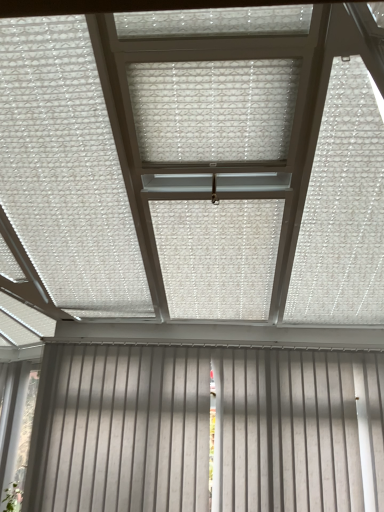
The width and height of the screenshot is (384, 512). Identify the location of white matte blinds at lower center. (203, 430).

The image size is (384, 512). Describe the element at coordinates (203, 430) in the screenshot. I see `white matte blinds at lower center` at that location.

Describe the element at coordinates (214, 110) in the screenshot. I see `translucent plastic blind at center` at that location.

The image size is (384, 512). I want to click on translucent plastic blind at center, so click(214, 110).

From the picture: Measure the distance between point (x=237, y=68) and camera.

Point (x=237, y=68) is 5.12 feet from camera.

Find the location of `white matte blinds at lower center`. white matte blinds at lower center is located at coordinates (203, 430).

Can you confirm if white matte blinds at lower center is positioned to the left of translucent plastic blind at center?

Incorrect, white matte blinds at lower center is not on the left side of translucent plastic blind at center.

From the picture: Which object is more forward, white matte blinds at lower center or translucent plastic blind at center?

translucent plastic blind at center is in front.

Considering the positions of points (199, 380) and (279, 156), is point (199, 380) farther from camera compared to point (279, 156)?

That is True.

From the image's perspective, who appears lower, white matte blinds at lower center or translucent plastic blind at center?

From the image's view, white matte blinds at lower center is below.

From a real-world perspective, is white matte blinds at lower center physically above translucent plastic blind at center?

No.

Is white matte blinds at lower center thinner than translucent plastic blind at center?

Yes.

Considering the sizes of white matte blinds at lower center and translucent plastic blind at center in the image, is white matte blinds at lower center taller or shorter than translucent plastic blind at center?

white matte blinds at lower center is taller than translucent plastic blind at center.

Considering the relative sizes of white matte blinds at lower center and translucent plastic blind at center in the image provided, is white matte blinds at lower center smaller than translucent plastic blind at center?

Incorrect, white matte blinds at lower center is not smaller in size than translucent plastic blind at center.

Does white matte blinds at lower center contain translucent plastic blind at center?

That's incorrect, translucent plastic blind at center is not inside white matte blinds at lower center.

Is white matte blinds at lower center next to translucent plastic blind at center?

No.

Is white matte blinds at lower center oriented towards translucent plastic blind at center?

No, white matte blinds at lower center does not turn towards translucent plastic blind at center.

The width and height of the screenshot is (384, 512). What are the coordinates of `blind positioned vertically above the white matte blinds at lower center (from a real-world perspective)` in the screenshot? It's located at [214, 110].

Is translucent plastic blind at center at the left side of white matte blinds at lower center?

Yes, translucent plastic blind at center is to the left of white matte blinds at lower center.

Considering the positions of objects translucent plastic blind at center and white matte blinds at lower center in the image provided, who is in front, translucent plastic blind at center or white matte blinds at lower center?

Positioned in front is translucent plastic blind at center.

Which is nearer, (158, 66) or (253, 485)?

The point (158, 66) is more forward.

From the image's perspective, who appears lower, translucent plastic blind at center or white matte blinds at lower center?

white matte blinds at lower center appears lower in the image.

From a real-world perspective, is translucent plastic blind at center on white matte blinds at lower center?

Indeed, from a real-world perspective, translucent plastic blind at center stands above white matte blinds at lower center.

Can you confirm if translucent plastic blind at center is wider than white matte blinds at lower center?

Yes.

Which of these two, translucent plastic blind at center or white matte blinds at lower center, stands shorter?

Standing shorter between the two is translucent plastic blind at center.

Who is bigger, translucent plastic blind at center or white matte blinds at lower center?

Bigger between the two is white matte blinds at lower center.

Can we say translucent plastic blind at center lies outside white matte blinds at lower center?

→ Absolutely, translucent plastic blind at center is external to white matte blinds at lower center.

Is there a large distance between translucent plastic blind at center and white matte blinds at lower center?

Yes, translucent plastic blind at center is far from white matte blinds at lower center.

Is translucent plastic blind at center looking in the opposite direction of white matte blinds at lower center?

No, translucent plastic blind at center's orientation is not away from white matte blinds at lower center.

In the image, there is a translucent plastic blind at center. Identify the location of garage door below it (from the image's perspective). (203, 430).

This screenshot has width=384, height=512. I want to click on blind that appears on the left of white matte blinds at lower center, so click(214, 110).

Identify the location of garage door below the translucent plastic blind at center (from the image's perspective). This screenshot has height=512, width=384. (203, 430).